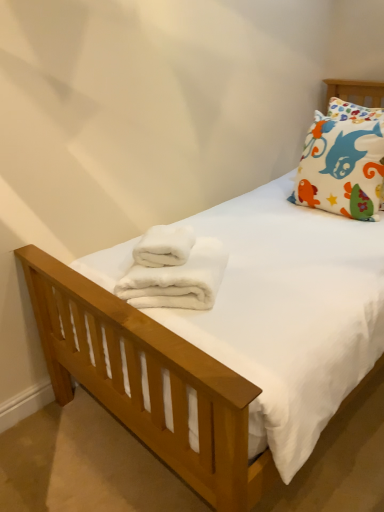
Question: Can you confirm if white cotton pillow at upper right is wider than white fluffy bath towel at center, the 1th bath towel positioned from the bottom?

Choices:
 (A) yes
 (B) no

Answer: (B)

Question: Considering the relative sizes of white cotton pillow at upper right and white fluffy bath towel at center, the 1th bath towel positioned from the bottom, in the image provided, is white cotton pillow at upper right thinner than white fluffy bath towel at center, the 1th bath towel positioned from the bottom,?

Choices:
 (A) no
 (B) yes

Answer: (B)

Question: Considering the relative positions of white cotton pillow at upper right and white fluffy bath towel at center, the second bath towel in the top-to-bottom sequence, in the image provided, is white cotton pillow at upper right to the right of white fluffy bath towel at center, the second bath towel in the top-to-bottom sequence, from the viewer's perspective?

Choices:
 (A) yes
 (B) no

Answer: (A)

Question: Is white cotton pillow at upper right at the left side of white fluffy bath towel at center, the second bath towel in the top-to-bottom sequence?

Choices:
 (A) yes
 (B) no

Answer: (B)

Question: From the image's perspective, does white cotton pillow at upper right appear higher than white fluffy bath towel at center, the 1th bath towel positioned from the bottom?

Choices:
 (A) yes
 (B) no

Answer: (A)

Question: Would you say white fluffy bath towel at center, the second bath towel in the top-to-bottom sequence, is to the left or to the right of white cotton pillow at upper right in the picture?

Choices:
 (A) right
 (B) left

Answer: (B)

Question: From the image's perspective, is white fluffy bath towel at center, the second bath towel in the top-to-bottom sequence, located above or below white cotton pillow at upper right?

Choices:
 (A) below
 (B) above

Answer: (A)

Question: Is white fluffy bath towel at center, the second bath towel in the top-to-bottom sequence, taller or shorter than white cotton pillow at upper right?

Choices:
 (A) tall
 (B) short

Answer: (B)

Question: Considering the positions of white fluffy bath towel at center, the second bath towel in the top-to-bottom sequence, and white cotton pillow at upper right in the image, is white fluffy bath towel at center, the second bath towel in the top-to-bottom sequence, wider or thinner than white cotton pillow at upper right?

Choices:
 (A) wide
 (B) thin

Answer: (A)

Question: From the image's perspective, is white fluffy bath towel at center, the first bath towel when ordered from top to bottom, positioned above or below white fluffy bath towel at center, the 1th bath towel positioned from the bottom?

Choices:
 (A) above
 (B) below

Answer: (A)

Question: Would you say white fluffy bath towel at center, the first bath towel when ordered from top to bottom, is to the left or to the right of white fluffy bath towel at center, the 1th bath towel positioned from the bottom, in the picture?

Choices:
 (A) left
 (B) right

Answer: (A)

Question: Considering the positions of white fluffy bath towel at center, which appears as the 2th bath towel when ordered from the bottom, and white fluffy bath towel at center, the second bath towel in the top-to-bottom sequence, in the image, is white fluffy bath towel at center, which appears as the 2th bath towel when ordered from the bottom, bigger or smaller than white fluffy bath towel at center, the second bath towel in the top-to-bottom sequence,?

Choices:
 (A) small
 (B) big

Answer: (A)

Question: Is white fluffy bath towel at center, the first bath towel when ordered from top to bottom, in front of or behind white fluffy bath towel at center, the second bath towel in the top-to-bottom sequence, in the image?

Choices:
 (A) front
 (B) behind

Answer: (B)

Question: Is white cotton pillow at upper right spatially inside white fluffy bath towel at center, the first bath towel when ordered from top to bottom, or outside of it?

Choices:
 (A) inside
 (B) outside

Answer: (B)

Question: Visually, is white cotton pillow at upper right positioned to the left or to the right of white fluffy bath towel at center, which appears as the 2th bath towel when ordered from the bottom?

Choices:
 (A) right
 (B) left

Answer: (A)